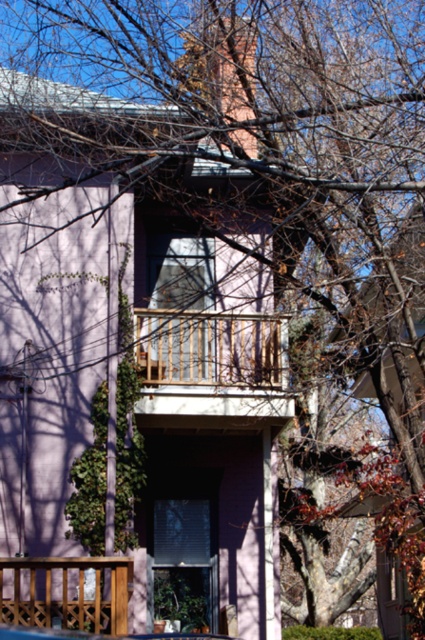
Is wooden at center positioned at the back of wooden at lower left?

Yes, it is.

Between wooden at center and wooden at lower left, which one has more height?

wooden at center

Does point (201, 355) come farther from viewer compared to point (62, 620)?

Yes, point (201, 355) is behind point (62, 620).

Where is `wooden at center`? This screenshot has height=640, width=425. wooden at center is located at coordinates (207, 348).